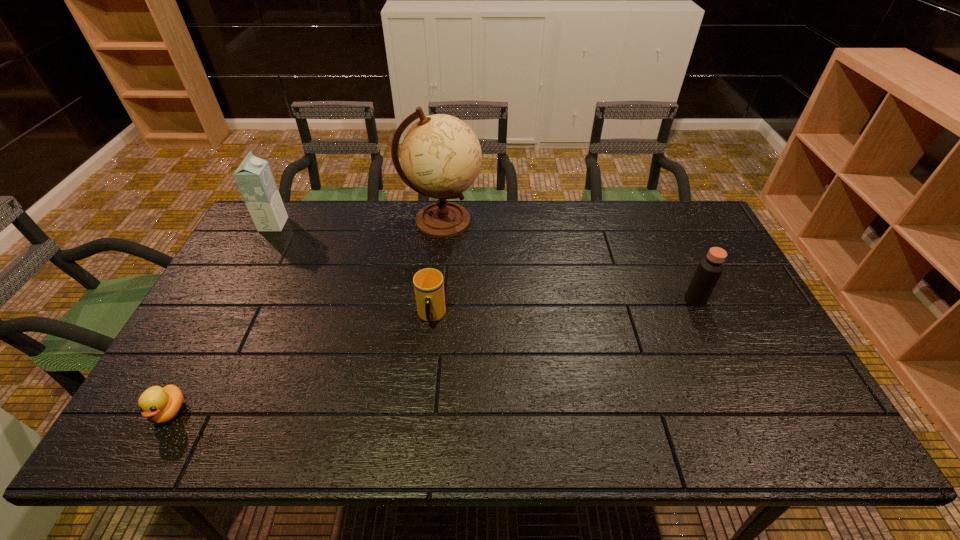
Where is `globe`? globe is located at coordinates [x=441, y=157].

Identify the location of the fourth shortest object. The width and height of the screenshot is (960, 540). (254, 178).

Locate an element on the screen. This screenshot has width=960, height=540. the rightmost object is located at coordinates (710, 268).

Find the location of a particular element. the third shortest object is located at coordinates (710, 268).

Where is `cup`? cup is located at coordinates (428, 283).

You are a GUI agent. You are given a task and a screenshot of the screen. Output one action in this format:
    pyautogui.click(x=<x>, y=<y>)
    Task: Click on the shortest object
    Image resolution: width=960 pixels, height=540 pixels.
    Given the screenshot: What is the action you would take?
    pyautogui.click(x=159, y=405)

In order to click on duckling in this screenshot , I will do `click(159, 405)`.

Locate an element on the screen. The image size is (960, 540). free space located on the surface of the tallest object is located at coordinates (591, 221).

Locate an element on the screen. The height and width of the screenshot is (540, 960). free space located 0.320m on the front label of the carton is located at coordinates (378, 224).

At what (x,y) coordinates should I click in order to perform the action: click on vacant region located 0.290m on the left of the vinegar. Please return your answer as a coordinate pair (x, y). The height and width of the screenshot is (540, 960). Looking at the image, I should click on pyautogui.click(x=585, y=299).